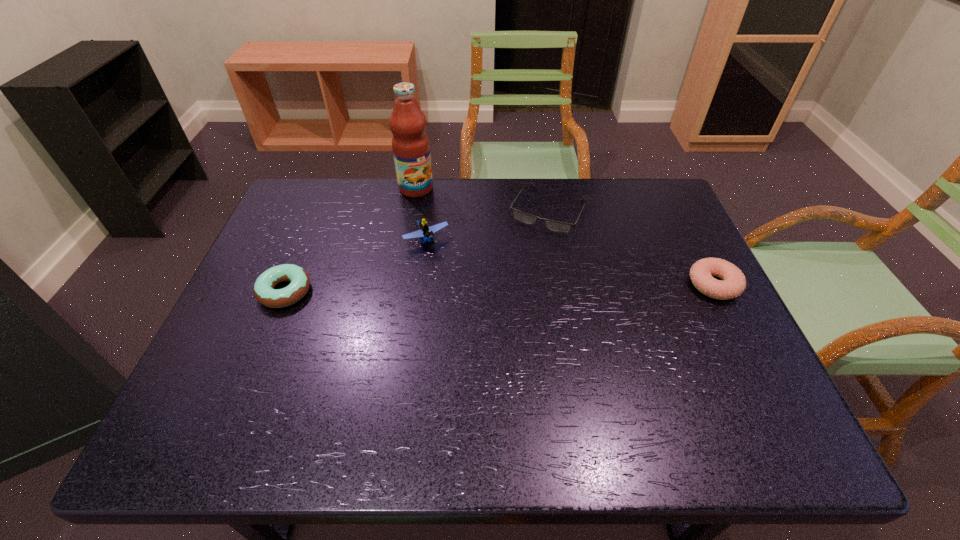
Find the location of a particular element. the left doughnut is located at coordinates (264, 291).

The width and height of the screenshot is (960, 540). Identify the location of the rightmost object. (734, 282).

Locate an element on the screen. the fourth object from left to right is located at coordinates coord(524,217).

The height and width of the screenshot is (540, 960). Find the location of `Lego`. Lego is located at coordinates (425, 233).

Locate an element on the screen. the tallest object is located at coordinates (410, 144).

The image size is (960, 540). Find the location of `free space located on the front of the left doughnut`. free space located on the front of the left doughnut is located at coordinates 252,369.

Where is `vacant space located on the left of the right doughnut`? vacant space located on the left of the right doughnut is located at coordinates (542, 285).

Find the location of `free location located 0.090m on the front-facing side of the spectacles`. free location located 0.090m on the front-facing side of the spectacles is located at coordinates (524, 254).

At what (x,y) coordinates should I click in order to perform the action: click on free space located 0.400m on the front-facing side of the spectacles. Please return your answer as a coordinate pair (x, y). This screenshot has height=540, width=960. Looking at the image, I should click on (477, 340).

The width and height of the screenshot is (960, 540). Find the location of `blank space located 0.130m on the front-facing side of the spectacles`. blank space located 0.130m on the front-facing side of the spectacles is located at coordinates click(x=519, y=264).